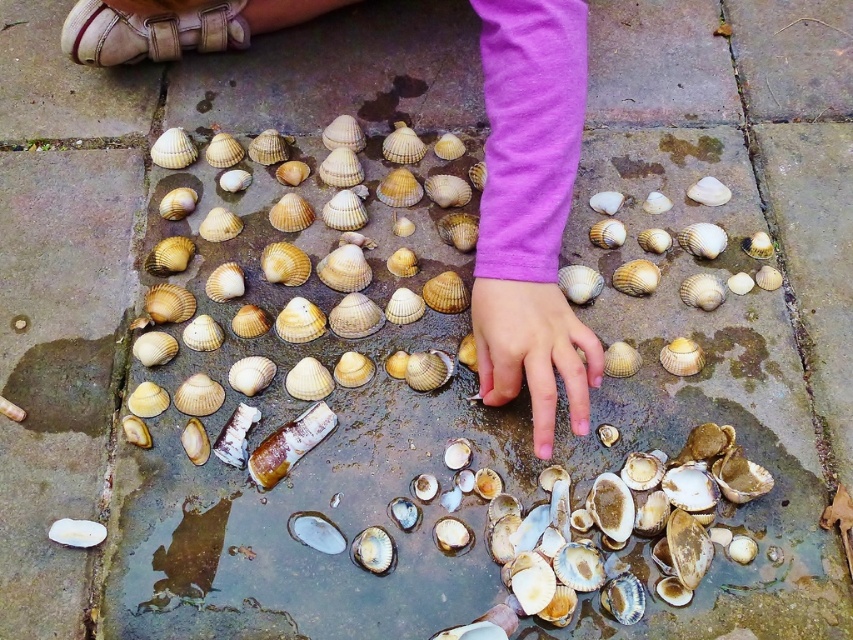
Question: Is smooth beige shell at center above white matte shell at center?

Choices:
 (A) yes
 (B) no

Answer: (A)

Question: Which object is positioned farthest from the smooth skin hand at center?

Choices:
 (A) white matte shell at center
 (B) smooth beige shell at center

Answer: (A)

Question: Where is smooth beige shell at center located in relation to white matte shell at center in the image?

Choices:
 (A) below
 (B) above

Answer: (B)

Question: Which point is farther from the camera taking this photo?

Choices:
 (A) (671, 371)
 (B) (68, 518)

Answer: (A)

Question: Is smooth skin hand at center behind white matte shell at center?

Choices:
 (A) yes
 (B) no

Answer: (B)

Question: Which point is closer to the camera taking this photo?

Choices:
 (A) (67, 524)
 (B) (665, 355)

Answer: (A)